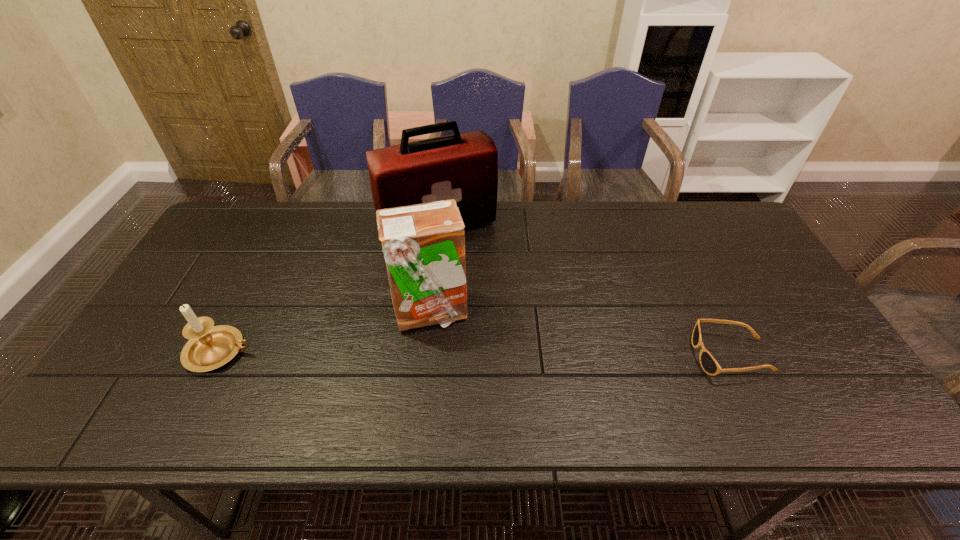
In order to click on free spot between the sunglasses and the farthest object in this screenshot , I will do `click(585, 291)`.

In order to click on unoccupied position between the shortest object and the carton in this screenshot , I will do `click(581, 334)`.

Identify the location of free area in between the farthest object and the shortest object. Image resolution: width=960 pixels, height=540 pixels. (585, 291).

Where is `blank region between the sunglasses and the candle holder`? blank region between the sunglasses and the candle holder is located at coordinates pyautogui.click(x=475, y=354).

Where is `empty space between the third tallest object and the carton`? This screenshot has height=540, width=960. empty space between the third tallest object and the carton is located at coordinates (325, 332).

Identify which object is the closest to the farthest object. Please provide its 2D coordinates. Your answer should be formatted as a tuple, i.e. [(x, y)], where the tuple contains the x and y coordinates of a point satisfying the conditions above.

[(423, 244)]

Locate which object is the third closest to the rightmost object. Please provide its 2D coordinates. Your answer should be formatted as a tuple, i.e. [(x, y)], where the tuple contains the x and y coordinates of a point satisfying the conditions above.

[(210, 347)]

The image size is (960, 540). In order to click on vacant space that satisfies the following two spatial constraints: 1. on the front side of the farthest object; 2. on the right side of the carton in this screenshot , I will do `click(429, 312)`.